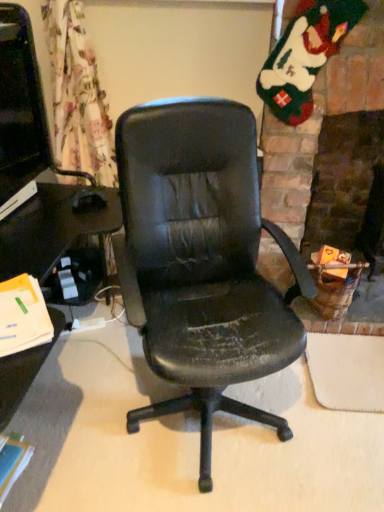
Question: From a real-world perspective, is matte black monitor at left located higher than fuzzy felt stocking at upper right?

Choices:
 (A) yes
 (B) no

Answer: (B)

Question: Is matte black monitor at left facing away from fuzzy felt stocking at upper right?

Choices:
 (A) no
 (B) yes

Answer: (A)

Question: Is matte black monitor at left shorter than fuzzy felt stocking at upper right?

Choices:
 (A) yes
 (B) no

Answer: (A)

Question: Does matte black monitor at left appear on the left side of fuzzy felt stocking at upper right?

Choices:
 (A) no
 (B) yes

Answer: (B)

Question: Is matte black monitor at left thinner than fuzzy felt stocking at upper right?

Choices:
 (A) yes
 (B) no

Answer: (B)

Question: Is matte black monitor at left facing towards fuzzy felt stocking at upper right?

Choices:
 (A) no
 (B) yes

Answer: (A)

Question: Is fuzzy felt stocking at upper right aimed at matte black monitor at left?

Choices:
 (A) no
 (B) yes

Answer: (A)

Question: Does fuzzy felt stocking at upper right come in front of matte black monitor at left?

Choices:
 (A) no
 (B) yes

Answer: (A)

Question: Does fuzzy felt stocking at upper right have a smaller size compared to matte black monitor at left?

Choices:
 (A) no
 (B) yes

Answer: (B)

Question: From the image's perspective, is fuzzy felt stocking at upper right under matte black monitor at left?

Choices:
 (A) no
 (B) yes

Answer: (A)

Question: Does fuzzy felt stocking at upper right have a lesser width compared to matte black monitor at left?

Choices:
 (A) no
 (B) yes

Answer: (B)

Question: From the image's perspective, is fuzzy felt stocking at upper right on top of matte black monitor at left?

Choices:
 (A) no
 (B) yes

Answer: (B)

Question: Which is correct: matte black monitor at left is inside fuzzy felt stocking at upper right, or outside of it?

Choices:
 (A) inside
 (B) outside

Answer: (B)